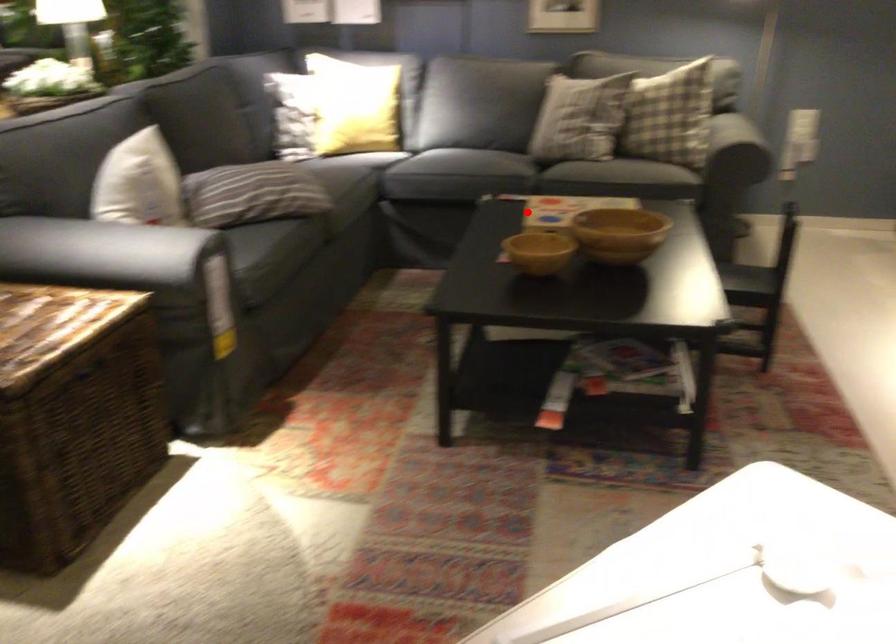
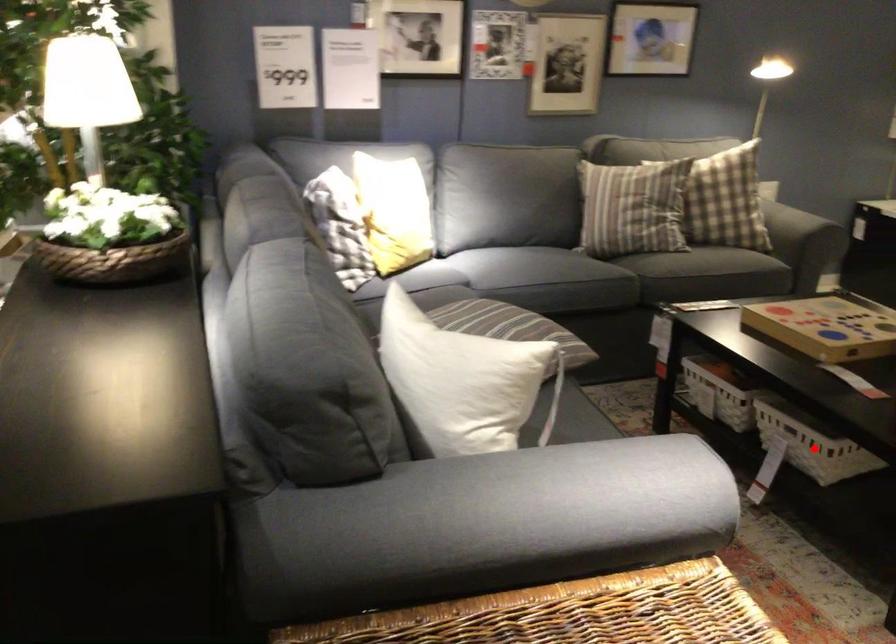
I am providing you with two images of the same scene from different viewpoints. A red point is marked on the first image and another point is marked on the second image. Are the points marked in image1 and image2 representing the same 3D position?

No